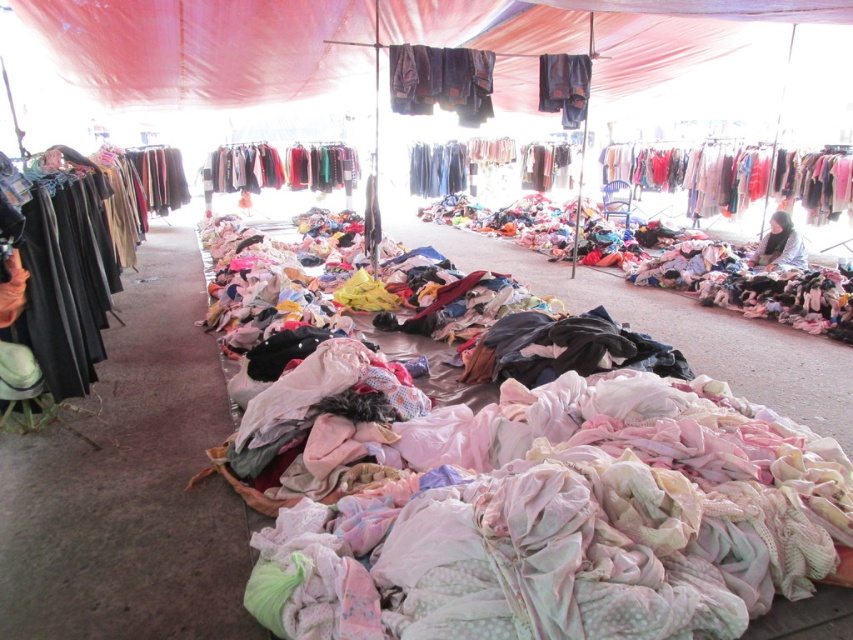
Question: Which point is closer to the camera taking this photo?

Choices:
 (A) (120, 212)
 (B) (770, 243)
 (C) (392, 60)
 (D) (222, 176)

Answer: (A)

Question: Is pastel cotton shirts at right in front of shiny metallic jackets at center?

Choices:
 (A) yes
 (B) no

Answer: (A)

Question: Which is nearer to the matte red fabric canopy at upper center?

Choices:
 (A) shiny metallic jackets at center
 (B) light pink fabric pants at center
 (C) white cotton shirt at center

Answer: (B)

Question: Which of these objects is positioned closest to the dark blue jeans at center?

Choices:
 (A) dark blue denim jeans at center
 (B) matte red fabric canopy at upper center
 (C) shiny metallic jackets at center

Answer: (A)

Question: Does pastel cotton shirts at right appear on the left side of light pink fabric pants at center?

Choices:
 (A) no
 (B) yes

Answer: (A)

Question: Does matte red fabric canopy at upper center appear on the left side of light pink fabric pants at center?

Choices:
 (A) no
 (B) yes

Answer: (A)